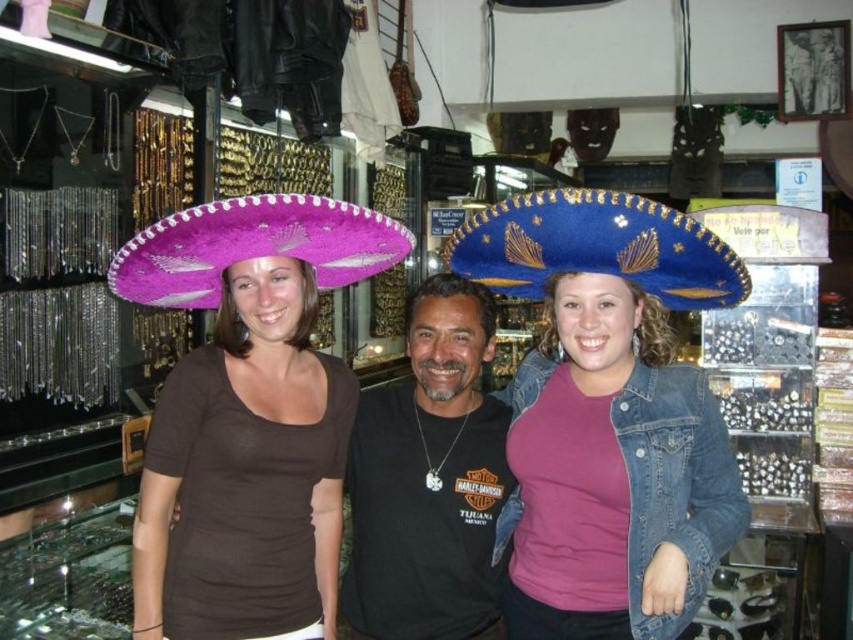
Based on the photo, you are standing in a store and see the blue denim jacket at center. What are the exact coordinates where you can find it?

The blue denim jacket at center is located at coordinates point (613, 474).

You are a photographer standing in the store and want to take a closeup photo of the matte pink fabric sombrero at upper left. You have a camera that can focus on objects as close as 1.5 meters. Can you take the photo without moving closer?

The matte pink fabric sombrero at upper left is 1.63 meters away from the viewer. Since the camera can focus as close as 1.5 meters, you need to move closer to 1.5 meters or less to capture the closeup.

You are trying to decide which sombrero to buy as a gift. The recipient prefers items that are larger in size. Based on the image, which sombrero should you choose between the matte pink fabric sombrero at upper left and the blue felt sombrero at center?

The matte pink fabric sombrero at upper left is bigger than the blue felt sombrero at center, so you should choose the matte pink fabric sombrero at upper left as it meets the recipient preference for larger items.